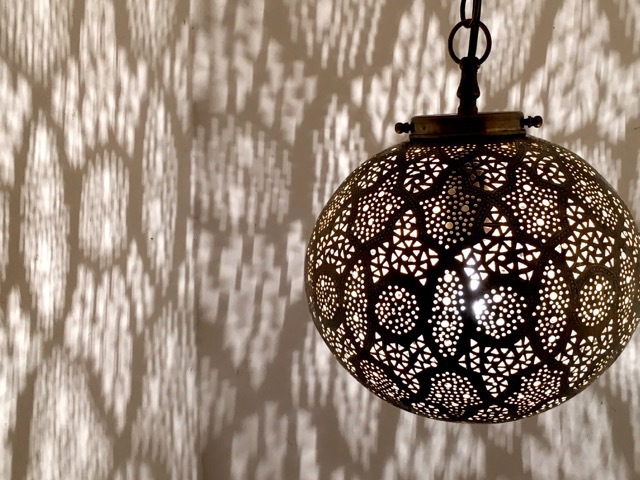
Where is `bright light`? bright light is located at coordinates (472, 282).